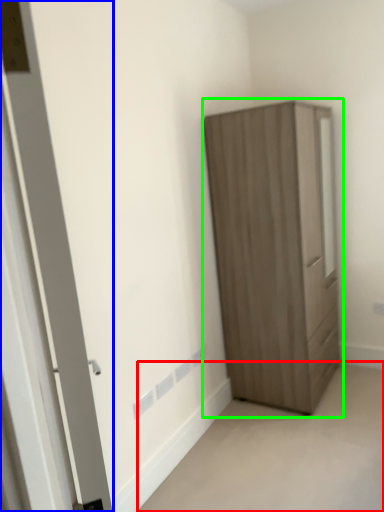
Question: Which object is positioned closest to corridor (highlighted by a red box)? Select from door (highlighted by a blue box) and cupboard (highlighted by a green box).

Choices:
 (A) door
 (B) cupboard

Answer: (B)